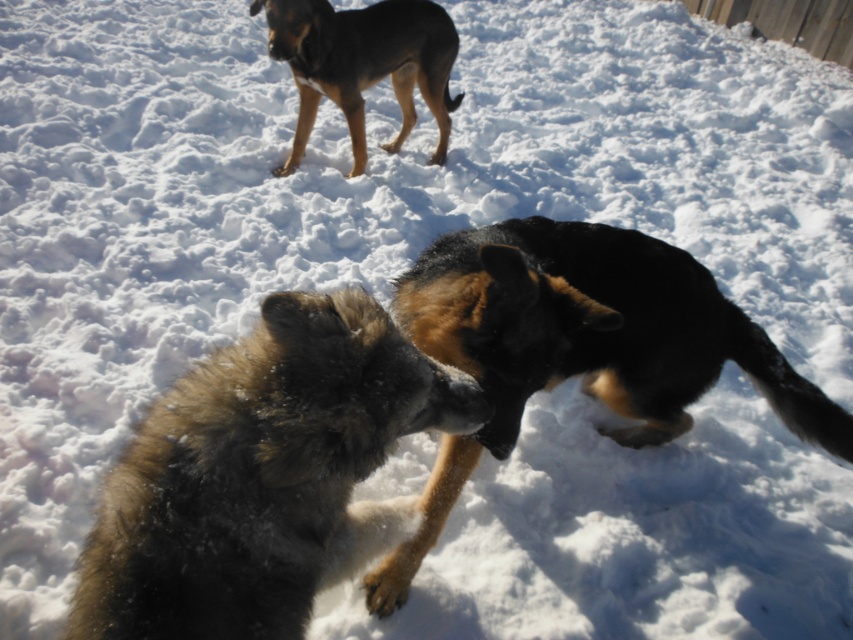
You are a dog owner trying to decide which dog to adopt. You prefer a dog with a thinner build. Based on the image, which dog between the fuzzy fur dog at center and the brown fur dog at upper left would you choose?

The fuzzy fur dog at center is thinner than the brown fur dog at upper left, so you should choose the fuzzy fur dog at center.

You are a photographer trying to capture a group photo of the fuzzy fur dog at center and the brown fur dog at upper left. If your camera can focus on subjects within a 10 feet range, will both dogs be in focus?

The distance between the fuzzy fur dog at center and the brown fur dog at upper left is 9.35 feet, which is within the 10 feet range. Therefore, both dogs will be in focus.

You are a photographer trying to capture a clear shot of both the black fur dog at center and the brown fur dog at upper left. Given their sizes, which dog will appear bigger in your photo?

The black fur dog at center will appear bigger in the photo because it is larger in size compared to the brown fur dog at upper left.